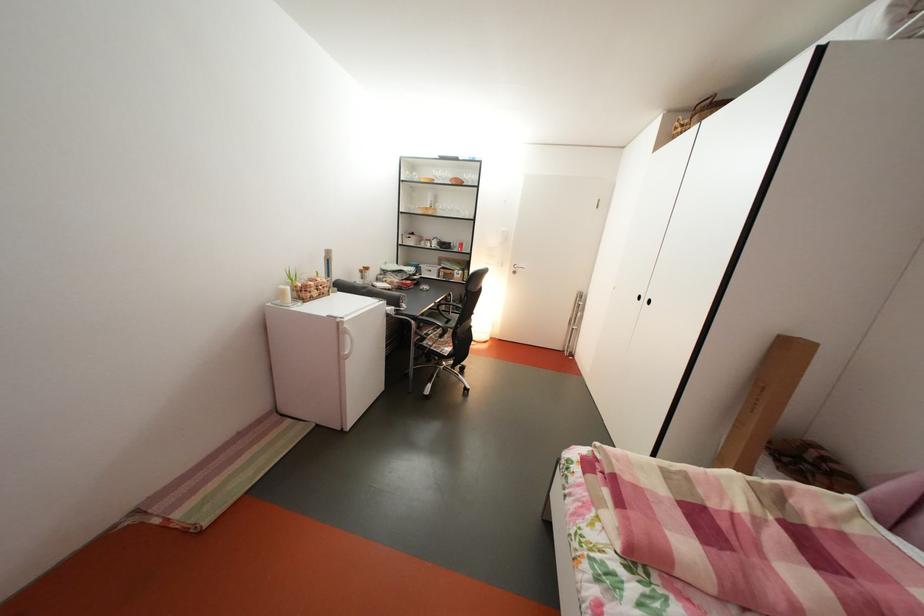
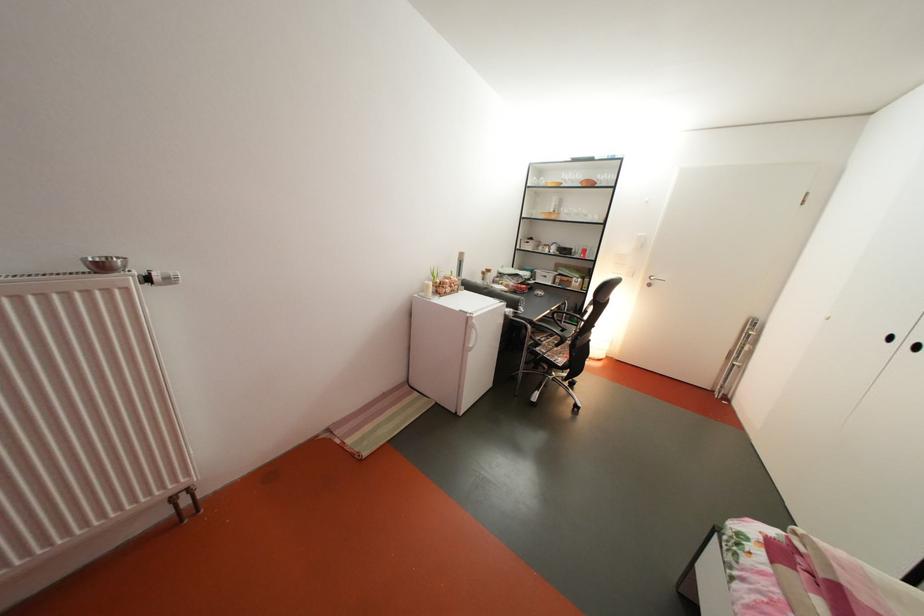
Locate, in the second image, the point that corresponds to the point at 468,185 in the first image.

(600, 187)